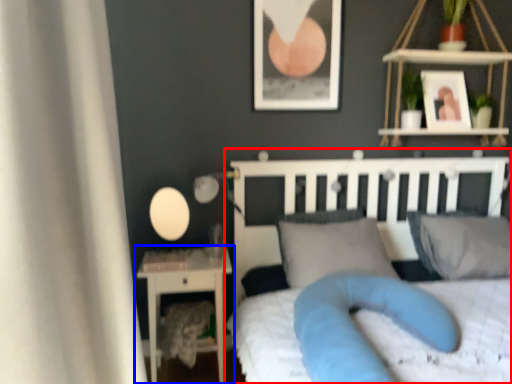
Question: Which object appears closest to the camera in this image, bed (highlighted by a red box) or nightstand (highlighted by a blue box)?

Choices:
 (A) bed
 (B) nightstand

Answer: (A)